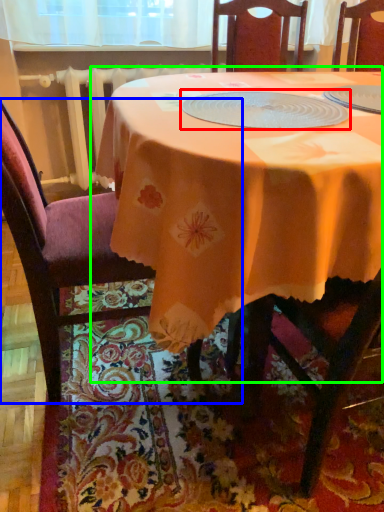
Question: Which is nearer to the tableware (highlighted by a red box)? chair (highlighted by a blue box) or table (highlighted by a green box).

Choices:
 (A) chair
 (B) table

Answer: (B)